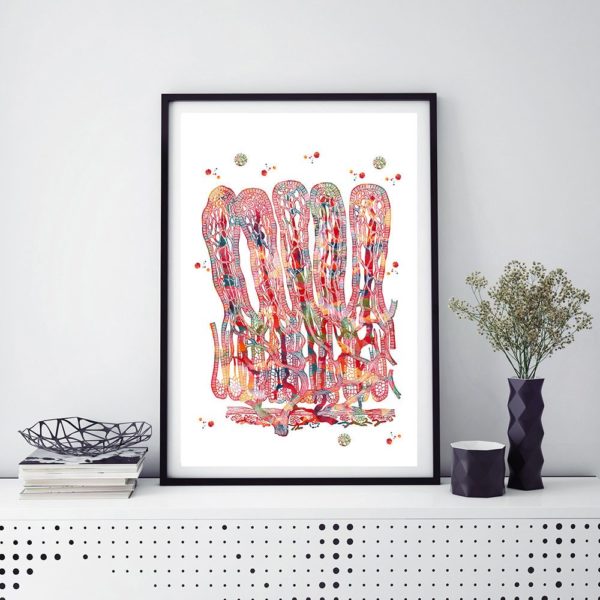
Locate an element on the screen. This screenshot has height=600, width=600. dried flowers is located at coordinates (526, 300).